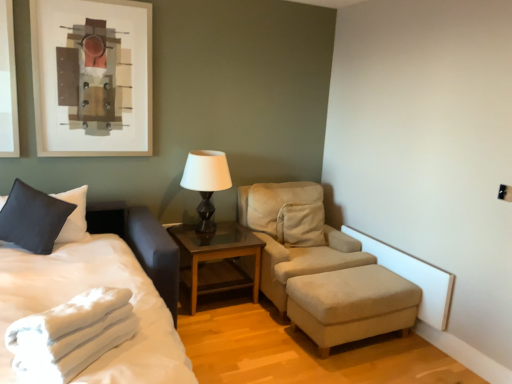
Question: Would you say beige fabric ottoman at lower right is inside or outside white soft towel at lower left?

Choices:
 (A) outside
 (B) inside

Answer: (A)

Question: Is point (325, 337) positioned closer to the camera than point (39, 369)?

Choices:
 (A) closer
 (B) farther

Answer: (B)

Question: Which of these objects is positioned farthest from the white soft bed at left?

Choices:
 (A) brown wooden table at center
 (B) white soft towel at lower left
 (C) beige fabric studio couch at center
 (D) matte black table lamp at center
 (E) matte black pillow at left

Answer: (C)

Question: Which object is the farthest from the beige fabric ottoman at lower right?

Choices:
 (A) white soft towel at lower left
 (B) white soft bed at left
 (C) brown wooden table at center
 (D) matte black pillow at left
 (E) beige fabric studio couch at center

Answer: (D)